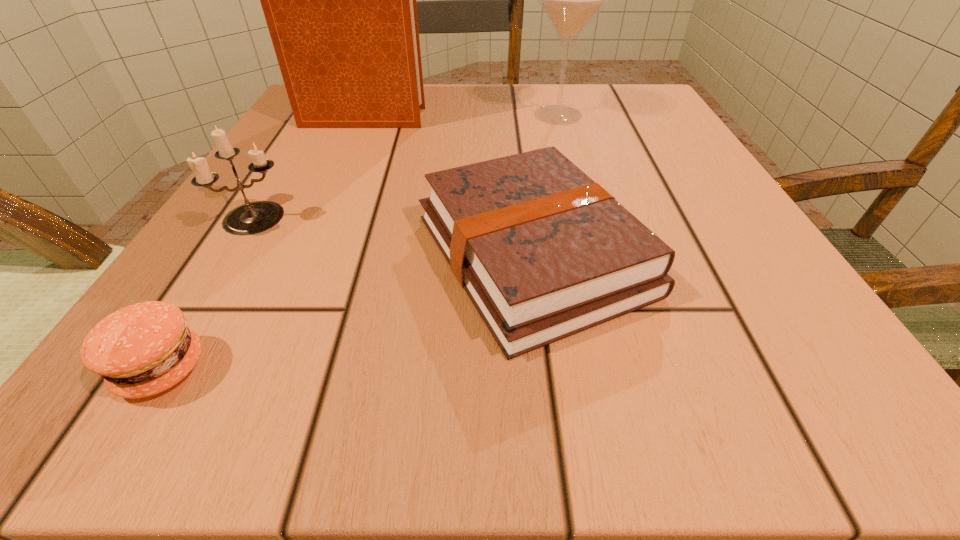
Identify the location of hardback book that is at the right edge. The width and height of the screenshot is (960, 540). (543, 252).

This screenshot has height=540, width=960. Identify the location of object situated at the far left corner. (339, 0).

Locate an element on the screen. The width and height of the screenshot is (960, 540). object present at the near left corner is located at coordinates (143, 349).

This screenshot has height=540, width=960. What are the coordinates of `object that is at the far right corner` in the screenshot? It's located at (570, 0).

Image resolution: width=960 pixels, height=540 pixels. I want to click on object that is at the near right corner, so click(543, 252).

What are the coordinates of `free point at the far edge` in the screenshot? It's located at (457, 96).

Where is `vacant space at the near edge`? Image resolution: width=960 pixels, height=540 pixels. vacant space at the near edge is located at coordinates (316, 355).

Locate an element on the screen. The image size is (960, 540). vacant space at the left edge is located at coordinates (264, 186).

I want to click on free space at the right edge, so click(x=726, y=212).

In order to click on vacant space at the near left corner in this screenshot , I will do `click(250, 362)`.